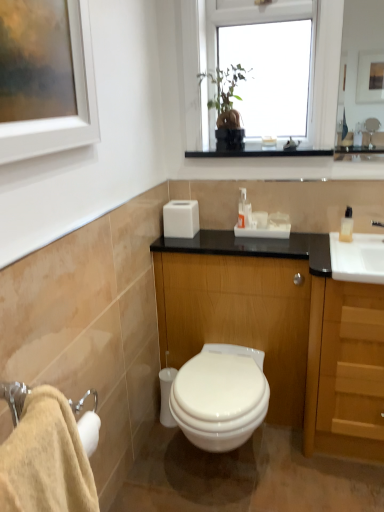
Question: Should I look upward or downward to see wooden cabinet at center?

Choices:
 (A) up
 (B) down

Answer: (B)

Question: Is wooden cabinet at center completely or partially inside light wood/wooden cabinet at right?

Choices:
 (A) yes
 (B) no

Answer: (B)

Question: Considering the relative positions of light wood/wooden cabinet at right and wooden cabinet at center in the image provided, is light wood/wooden cabinet at right in front of wooden cabinet at center?

Choices:
 (A) yes
 (B) no

Answer: (A)

Question: Is light wood/wooden cabinet at right not within wooden cabinet at center?

Choices:
 (A) yes
 (B) no

Answer: (A)

Question: Considering the relative sizes of light wood/wooden cabinet at right and wooden cabinet at center in the image provided, is light wood/wooden cabinet at right thinner than wooden cabinet at center?

Choices:
 (A) yes
 (B) no

Answer: (B)

Question: From the image's perspective, is light wood/wooden cabinet at right on wooden cabinet at center?

Choices:
 (A) yes
 (B) no

Answer: (B)

Question: Is light wood/wooden cabinet at right smaller than wooden cabinet at center?

Choices:
 (A) yes
 (B) no

Answer: (A)

Question: Is transparent glass window at upper center at the left side of white glossy toilet at center?

Choices:
 (A) yes
 (B) no

Answer: (B)

Question: From a real-world perspective, is transparent glass window at upper center located higher than white glossy toilet at center?

Choices:
 (A) yes
 (B) no

Answer: (A)

Question: Would you say white glossy toilet at center is part of transparent glass window at upper center's contents?

Choices:
 (A) no
 (B) yes

Answer: (A)

Question: Is transparent glass window at upper center far from white glossy toilet at center?

Choices:
 (A) no
 (B) yes

Answer: (B)

Question: Is transparent glass window at upper center to the right of white glossy toilet at center from the viewer's perspective?

Choices:
 (A) no
 (B) yes

Answer: (B)

Question: From the image's perspective, is transparent glass window at upper center beneath white glossy toilet at center?

Choices:
 (A) yes
 (B) no

Answer: (B)

Question: Is white glossy toilet at center to the left of transparent glass window at upper center from the viewer's perspective?

Choices:
 (A) yes
 (B) no

Answer: (A)